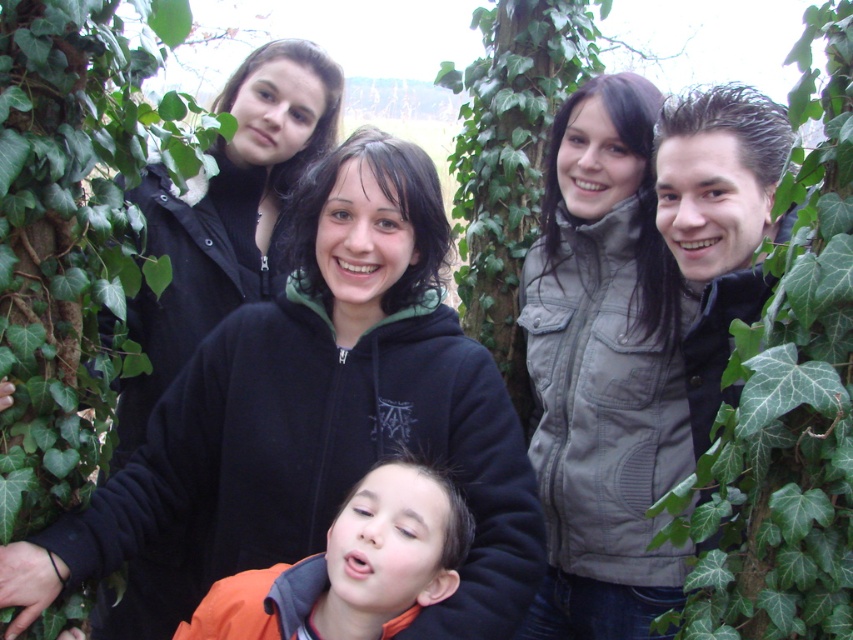
Question: Does green leafy ivy at center have a smaller size compared to orange fleece jacket at lower center?

Choices:
 (A) no
 (B) yes

Answer: (A)

Question: Which object is farther from the camera taking this photo?

Choices:
 (A) orange fleece jacket at lower center
 (B) green leafy ivy at center

Answer: (A)

Question: Does green leafy ivy at upper right have a lesser width compared to orange fleece jacket at lower center?

Choices:
 (A) yes
 (B) no

Answer: (A)

Question: Which is farther from the orange fleece jacket at lower center?

Choices:
 (A) green leafy ivy at center
 (B) green leafy ivy at upper right

Answer: (A)

Question: Among these points, which one is farthest from the camera?

Choices:
 (A) (723, 442)
 (B) (35, 472)

Answer: (B)

Question: In this image, where is green leafy ivy at center located relative to green leafy ivy at upper right?

Choices:
 (A) above
 (B) below

Answer: (A)